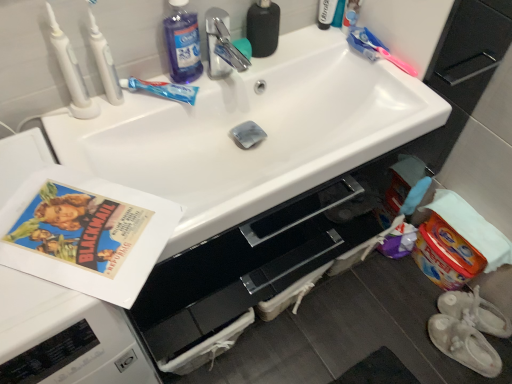
The image size is (512, 384). Find the location of `blank space situated above vintage paper at left (from a real-world perspective)`. blank space situated above vintage paper at left (from a real-world perspective) is located at coordinates (81, 226).